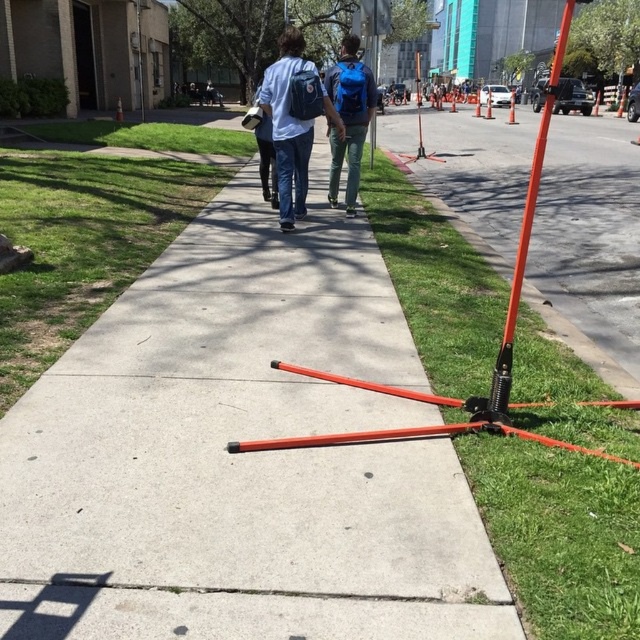
Question: Which point is closer to the camera?

Choices:
 (A) matte blue backpack at center
 (B) green grass at lower left
 (C) orange metal tripod at center

Answer: (C)

Question: Which object is closer to the camera taking this photo?

Choices:
 (A) orange metallic pole at right
 (B) matte blue backpack at center
 (C) orange grass at lower right

Answer: (C)

Question: Does matte blue backpack at center lie behind blue backpack at center?

Choices:
 (A) yes
 (B) no

Answer: (B)

Question: Which object is positioned farthest from the green grass at lower left?

Choices:
 (A) orange metallic pole at right
 (B) blue backpack at center

Answer: (A)

Question: Can you confirm if orange metal tripod at center is bigger than matte blue backpack at center?

Choices:
 (A) yes
 (B) no

Answer: (A)

Question: Where is orange metallic pole at right located in relation to orange metallic tripod at center in the image?

Choices:
 (A) right
 (B) left

Answer: (A)